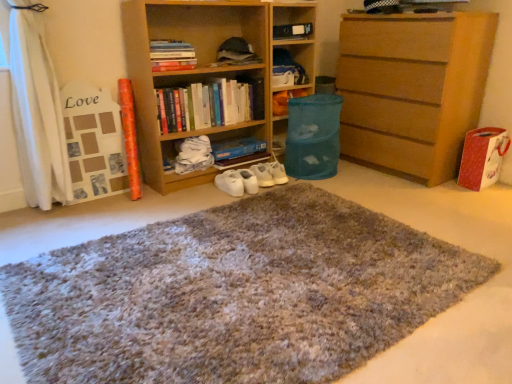
Identify the location of free space that is in between shaggy carpet at center and blue fabric bean bag chair at center. (314, 187).